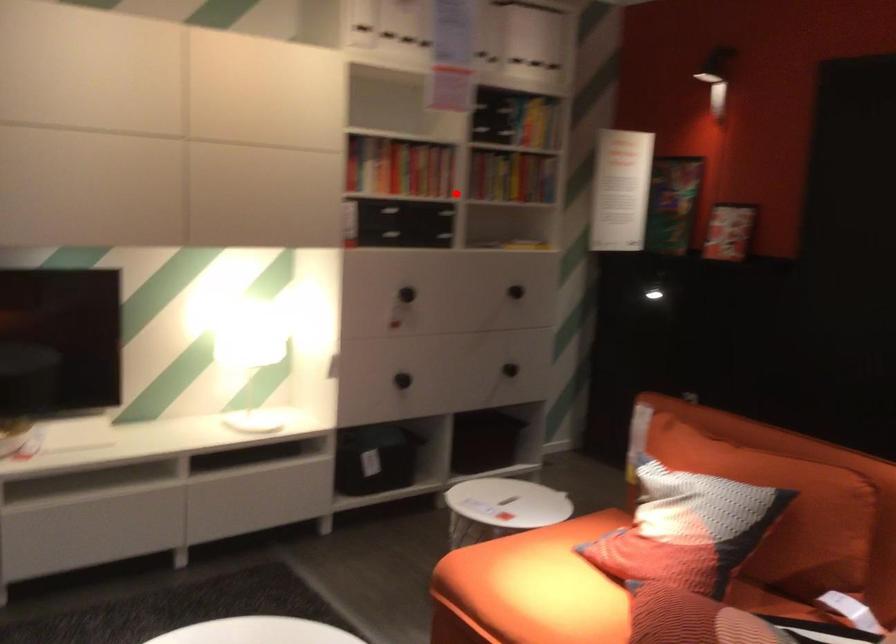
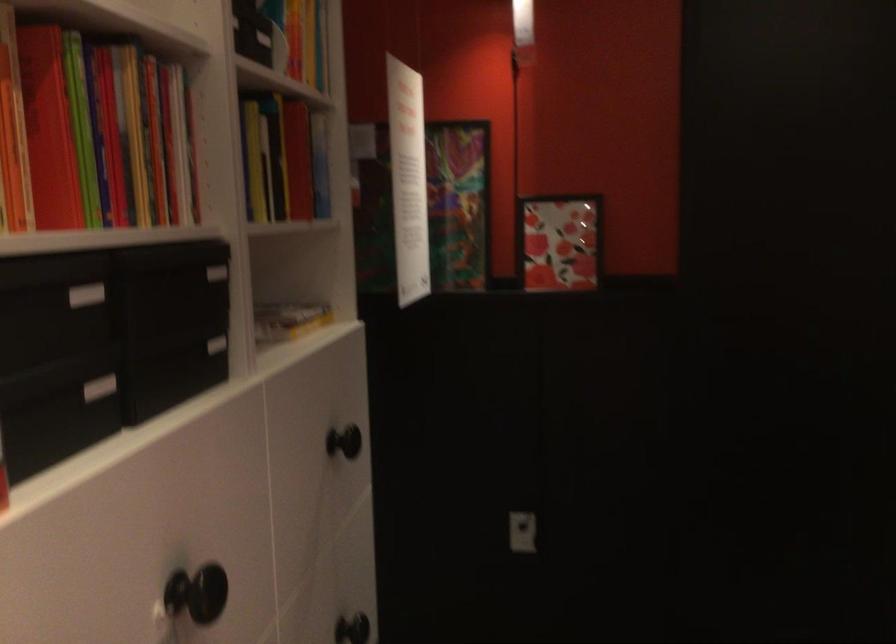
Find the pixel in the second image that matches the highlighted location in the first image.

(216, 272)